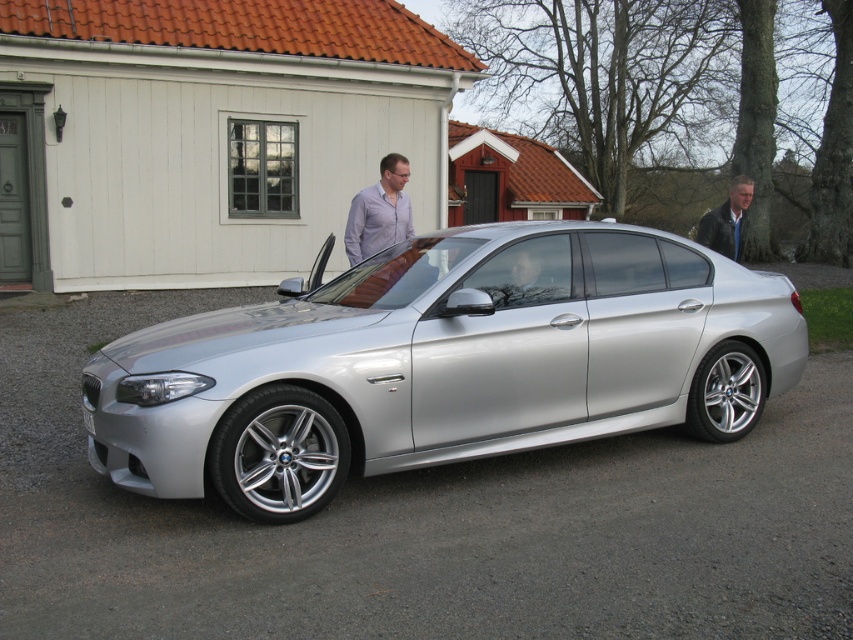
Question: Can you confirm if silver metallic car at center is positioned to the right of matte white shirt at center?

Choices:
 (A) yes
 (B) no

Answer: (A)

Question: Does matte white shirt at center appear on the right side of leather jacket at right?

Choices:
 (A) no
 (B) yes

Answer: (A)

Question: Which point is farther to the camera?

Choices:
 (A) leather jacket at right
 (B) matte white shirt at center
 (C) silver metallic car at center

Answer: (A)

Question: Which of the following is the farthest from the observer?

Choices:
 (A) (747, 188)
 (B) (316, 509)
 (C) (376, 250)

Answer: (A)

Question: Observing the image, what is the correct spatial positioning of silver metallic car at center in reference to matte white shirt at center?

Choices:
 (A) right
 (B) left

Answer: (A)

Question: Which point is closer to the camera?

Choices:
 (A) leather jacket at right
 (B) silver metallic car at center
 (C) matte white shirt at center

Answer: (B)